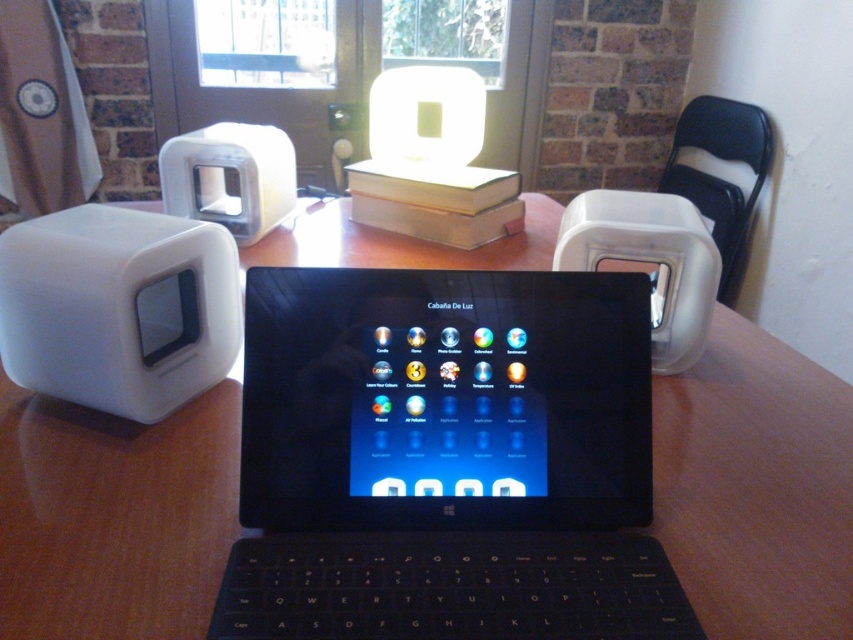
You are a designer working on the tablet and need to place a new object at the coordinates point (756, 486). According to the scene description, where will this new object be placed?

The point (756, 486) corresponds to the wooden table at center, so placing the new object there will position it on the wooden table at center.